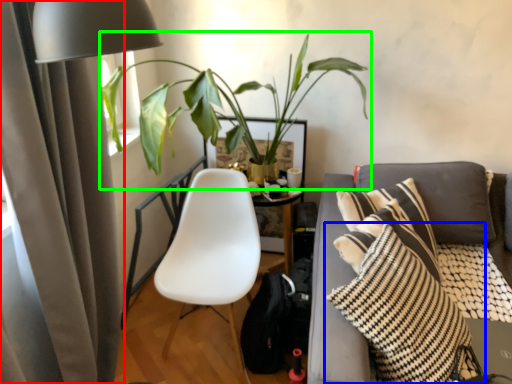
Question: Estimate the real-world distances between objects in this image. Which object is farther from curtain (highlighted by a red box), pillow (highlighted by a blue box) or houseplant (highlighted by a green box)?

Choices:
 (A) pillow
 (B) houseplant

Answer: (A)